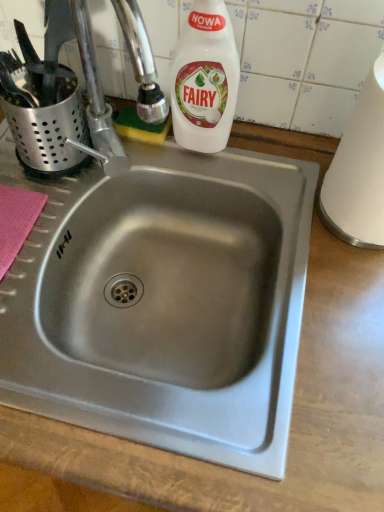
Identify the location of free area in between white matte paper towel at right and white plastic bottle at upper center. Image resolution: width=384 pixels, height=512 pixels. (261, 173).